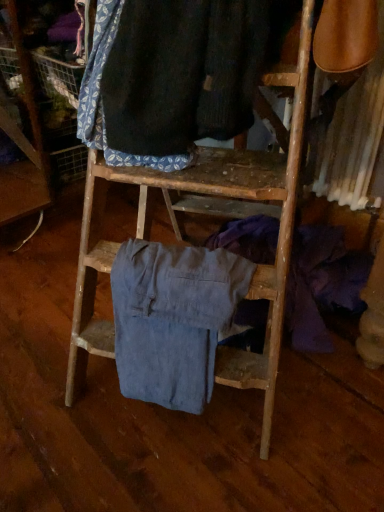
Question: Does point (170, 34) appear closer or farther from the camera than point (218, 281)?

Choices:
 (A) farther
 (B) closer

Answer: (B)

Question: From the image's perspective, is dark blue fabric at upper center, marked as the 2th clothing in a bottom-to-top arrangement, above or below denim pants at center, the first clothing in the bottom-to-top sequence?

Choices:
 (A) above
 (B) below

Answer: (A)

Question: Do you think dark blue fabric at upper center, which appears as the 1th clothing when viewed from the top, is within denim pants at center, the first clothing in the bottom-to-top sequence, or outside of it?

Choices:
 (A) outside
 (B) inside

Answer: (A)

Question: Is denim pants at center, positioned as the second clothing in top-to-bottom order, wider or thinner than dark blue fabric at upper center, marked as the 2th clothing in a bottom-to-top arrangement?

Choices:
 (A) wide
 (B) thin

Answer: (B)

Question: From a real-world perspective, is denim pants at center, the first clothing in the bottom-to-top sequence, above or below dark blue fabric at upper center, which appears as the 1th clothing when viewed from the top?

Choices:
 (A) below
 (B) above

Answer: (A)

Question: Would you say denim pants at center, the first clothing in the bottom-to-top sequence, is to the left or to the right of dark blue fabric at upper center, marked as the 2th clothing in a bottom-to-top arrangement, in the picture?

Choices:
 (A) right
 (B) left

Answer: (B)

Question: Do you think denim pants at center, the first clothing in the bottom-to-top sequence, is within dark blue fabric at upper center, marked as the 2th clothing in a bottom-to-top arrangement, or outside of it?

Choices:
 (A) inside
 (B) outside

Answer: (B)